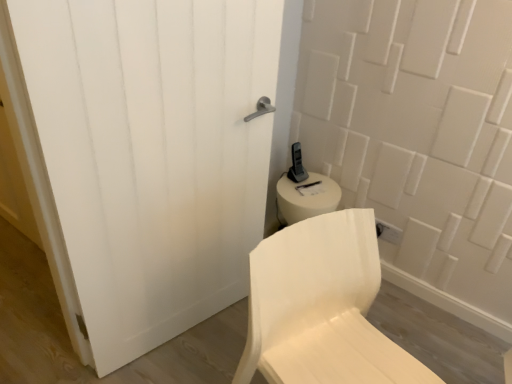
Measure the distance between point (345, 231) and camera.

A distance of 1.26 meters exists between point (345, 231) and camera.

What do you see at coordinates (321, 307) in the screenshot? I see `white matte chair at center` at bounding box center [321, 307].

Find the location of a particular element. white matte chair at center is located at coordinates (321, 307).

Image resolution: width=512 pixels, height=384 pixels. I want to click on white matte door at center, so click(158, 150).

The height and width of the screenshot is (384, 512). What do you see at coordinates (158, 150) in the screenshot?
I see `white matte door at center` at bounding box center [158, 150].

You are a GUI agent. You are given a task and a screenshot of the screen. Output one action in this format:
    pyautogui.click(x=<x>, y=<y>)
    Task: Click on the white matte chair at center
    The image size is (512, 384).
    Given the screenshot: What is the action you would take?
    pyautogui.click(x=321, y=307)

Between white matte chair at center and white matte door at center, which one appears on the right side from the viewer's perspective?

Positioned to the right is white matte chair at center.

Is white matte chair at center behind white matte door at center?

No.

Is point (368, 286) behind point (170, 312)?

No, it is in front of (170, 312).

From the image's perspective, is white matte chair at center located beneath white matte door at center?

Correct, white matte chair at center appears lower than white matte door at center in the image.

From a real-world perspective, is white matte chair at center on top of white matte door at center?

No, from a real-world perspective, white matte chair at center is not on top of white matte door at center.

From the picture: Considering the relative sizes of white matte chair at center and white matte door at center in the image provided, is white matte chair at center wider than white matte door at center?

Yes, white matte chair at center is wider than white matte door at center.

Does white matte chair at center have a lesser height compared to white matte door at center?

Yes.

Considering the sizes of objects white matte chair at center and white matte door at center in the image provided, who is bigger, white matte chair at center or white matte door at center?

white matte chair at center is bigger.

Is white matte chair at center not within white matte door at center?

Yes, white matte chair at center is outside of white matte door at center.

Is the surface of white matte chair at center in direct contact with white matte door at center?

No, white matte chair at center is not making contact with white matte door at center.

Is white matte chair at center facing towards white matte door at center?

No, white matte chair at center is not facing towards white matte door at center.

Can you tell me how much white matte chair at center and white matte door at center differ in facing direction?

1.38 degrees.

What are the coordinates of `chair in front of the white matte door at center` in the screenshot? It's located at (321, 307).

Which object is positioned more to the left, white matte door at center or white matte chair at center?

From the viewer's perspective, white matte door at center appears more on the left side.

Considering their positions, is white matte door at center located in front of or behind white matte chair at center?

Visually, white matte door at center is located behind white matte chair at center.

Considering the points (203, 63) and (411, 377), which point is in front, point (203, 63) or point (411, 377)?

The point (411, 377) is in front.

From the image's perspective, between white matte door at center and white matte chair at center, which one is located above?

white matte door at center.

From a real-world perspective, is white matte door at center positioned under white matte chair at center based on gravity?

Incorrect, from a real-world perspective, white matte door at center is higher than white matte chair at center.

Does white matte door at center have a lesser width compared to white matte chair at center?

Indeed, white matte door at center has a lesser width compared to white matte chair at center.

Considering the relative sizes of white matte door at center and white matte chair at center in the image provided, is white matte door at center shorter than white matte chair at center?

No.

In terms of size, does white matte door at center appear bigger or smaller than white matte chair at center?

In the image, white matte door at center appears to be smaller than white matte chair at center.

Is white matte door at center surrounding white matte chair at center?

No, white matte door at center does not contain white matte chair at center.

Is white matte door at center not near white matte chair at center?

No, white matte door at center is not far from white matte chair at center.

Is white matte door at center facing away from white matte chair at center?

white matte door at center is not turned away from white matte chair at center.

What's the angular difference between white matte door at center and white matte chair at center's facing directions?

1.38 degrees.

Where is `door behind the white matte chair at center`? The width and height of the screenshot is (512, 384). door behind the white matte chair at center is located at coordinates tap(158, 150).

Identify the location of chair on the right of white matte door at center. The image size is (512, 384). (321, 307).

You are a GUI agent. You are given a task and a screenshot of the screen. Output one action in this format:
    pyautogui.click(x=<x>, y=<y>)
    Task: Click on the door lying on the left of white matte chair at center
    
    Given the screenshot: What is the action you would take?
    pyautogui.click(x=158, y=150)